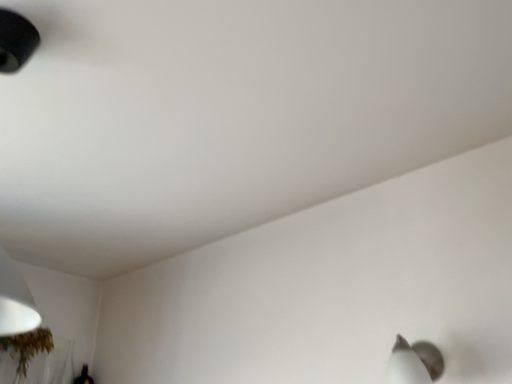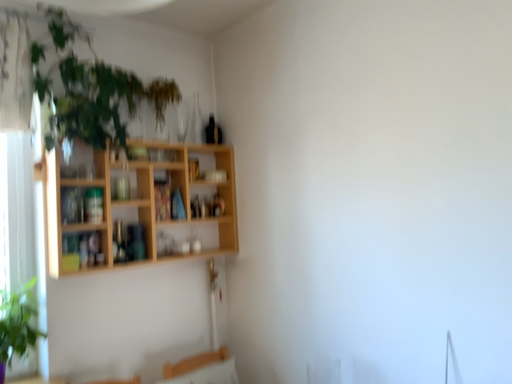
Question: Which way did the camera rotate in the video?

Choices:
 (A) rotated upward
 (B) rotated downward

Answer: (B)